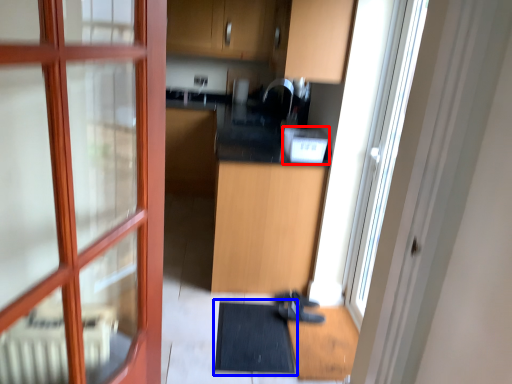
Question: Among these objects, which one is farthest to the camera, appliance (highlighted by a red box) or bath mat (highlighted by a blue box)?

Choices:
 (A) appliance
 (B) bath mat

Answer: (A)